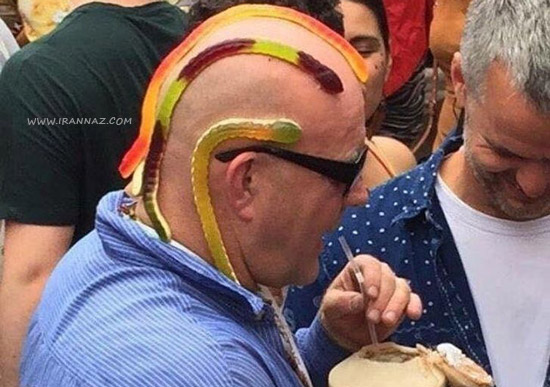
This screenshot has height=387, width=550. What are the coordinates of `red cloth` in the screenshot? It's located at (409, 25).